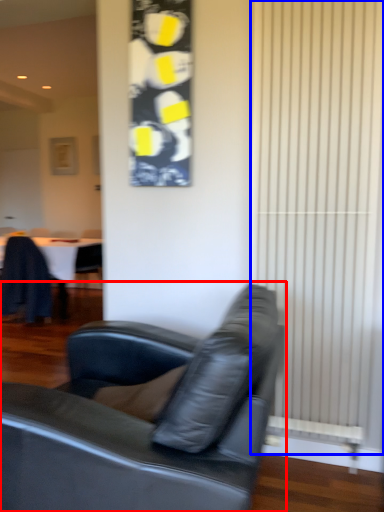
Question: Which object appears farthest to the camera in this image, studio couch (highlighted by a red box) or curtain (highlighted by a blue box)?

Choices:
 (A) studio couch
 (B) curtain

Answer: (B)